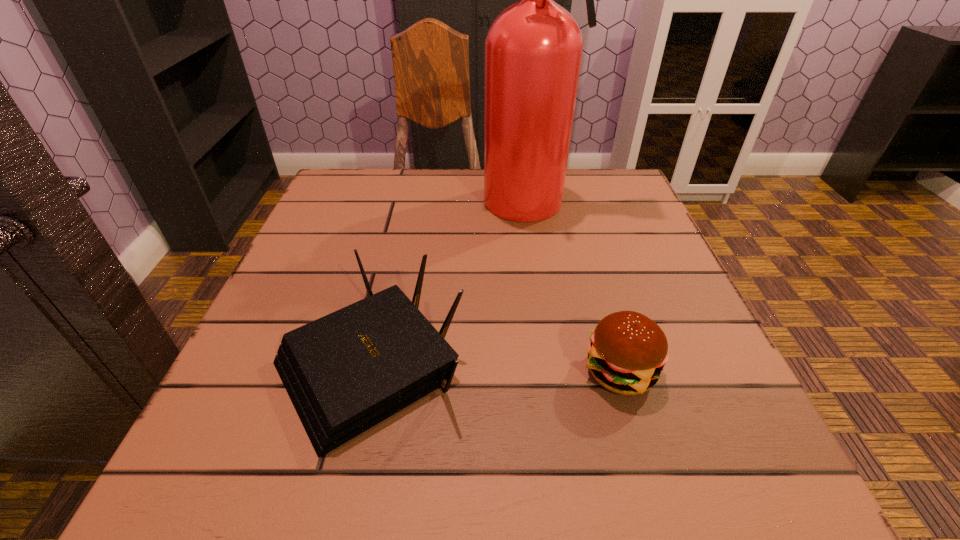
What are the coordinates of `the tallest object` in the screenshot? It's located at (533, 50).

The width and height of the screenshot is (960, 540). I want to click on fire extinguisher, so click(x=533, y=50).

Locate an element on the screen. The image size is (960, 540). router is located at coordinates (346, 372).

Where is `the leftmost object`? the leftmost object is located at coordinates (346, 372).

This screenshot has height=540, width=960. In order to click on hamburger in this screenshot , I will do `click(628, 351)`.

The width and height of the screenshot is (960, 540). I want to click on free space located 0.190m on the front of the farthest object, so click(x=553, y=284).

This screenshot has width=960, height=540. In order to click on vacant point located 0.300m on the right of the second shortest object in this screenshot , I will do `click(662, 366)`.

This screenshot has height=540, width=960. Identify the location of vacant space situated 0.070m on the back of the shortest object. [x=603, y=311].

At what (x,y) coordinates should I click in order to perform the action: click on object that is at the far edge. Please return your answer as a coordinate pair (x, y). Looking at the image, I should click on (533, 50).

You are a GUI agent. You are given a task and a screenshot of the screen. Output one action in this format:
    pyautogui.click(x=<x>, y=<y>)
    Task: Click on the object that is at the near edge
    The height and width of the screenshot is (540, 960).
    Given the screenshot: What is the action you would take?
    pyautogui.click(x=346, y=372)